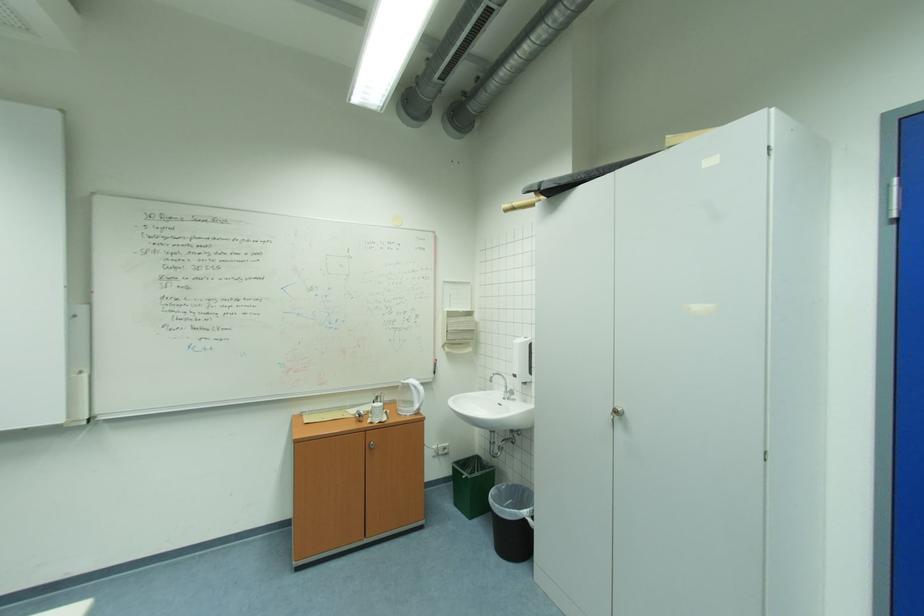
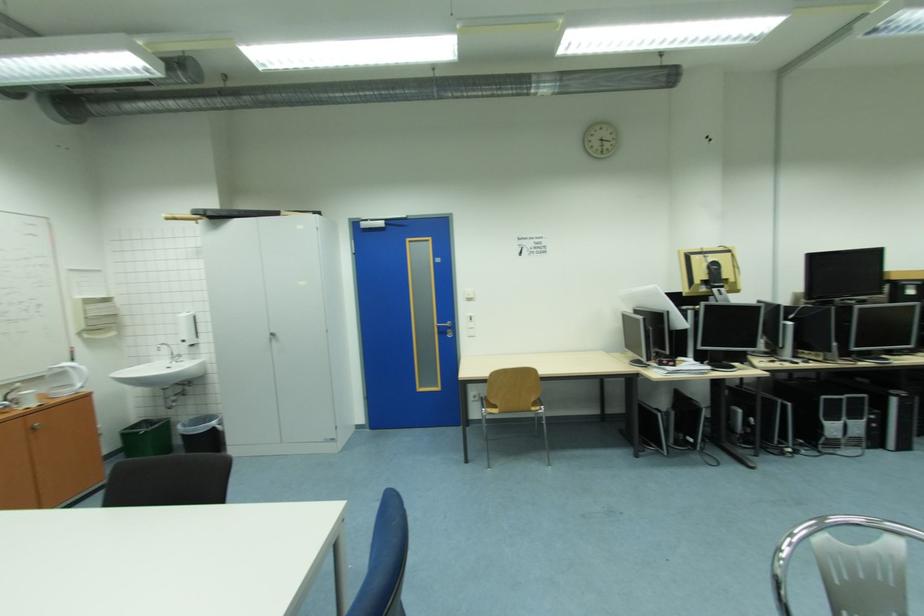
Find the pixel in the second image that matches point 623,418 in the first image.

(278, 338)